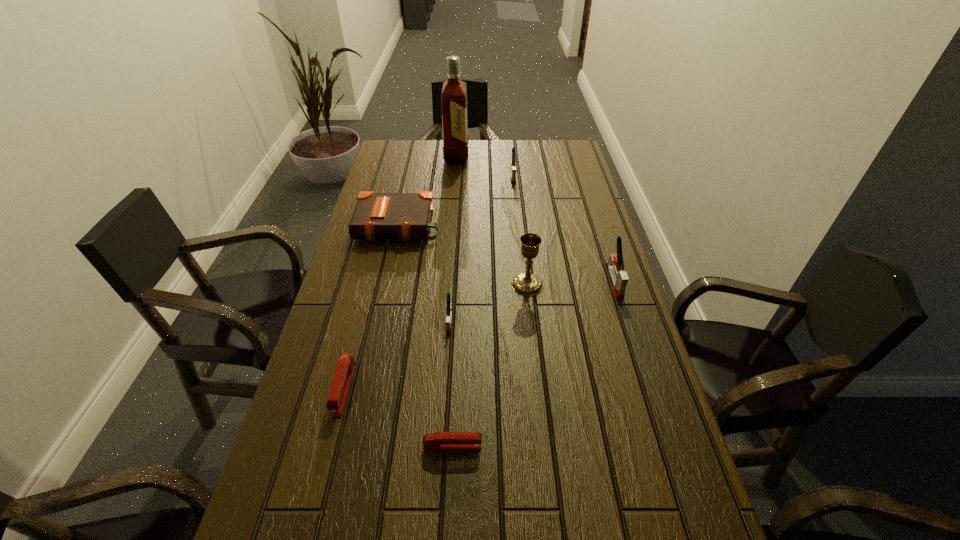
Where is `the left red stapler`? This screenshot has height=540, width=960. the left red stapler is located at coordinates (339, 389).

Where is `the second nearest stapler`? the second nearest stapler is located at coordinates (339, 389).

The width and height of the screenshot is (960, 540). What are the coordinates of `the shortest stapler` in the screenshot? It's located at 441,441.

This screenshot has width=960, height=540. Identify the location of the nearest stapler. (441, 441).

You are a GUI agent. You are given a task and a screenshot of the screen. Output one action in this format:
    pyautogui.click(x=<x>, y=<y>)
    Task: Click on the vacant space situated 0.290m on the front label of the tallest object
    This screenshot has height=540, width=960.
    Given the screenshot: What is the action you would take?
    pyautogui.click(x=539, y=157)

I want to click on free space located on the front of the second tallest object, so click(x=533, y=333).

I want to click on vacant space located 0.250m on the handle side of the second farthest gray stapler, so click(x=645, y=375).

Where is `vacant point located 0.260m on the handle side of the farthest stapler`? The image size is (960, 540). vacant point located 0.260m on the handle side of the farthest stapler is located at coordinates (518, 225).

Locate an element on the screen. vacant space located 0.320m on the handle side of the third tallest stapler is located at coordinates (441, 455).

Where is `vacant space located 0.250m on the spine side of the Bible`? This screenshot has width=960, height=540. vacant space located 0.250m on the spine side of the Bible is located at coordinates (381, 302).